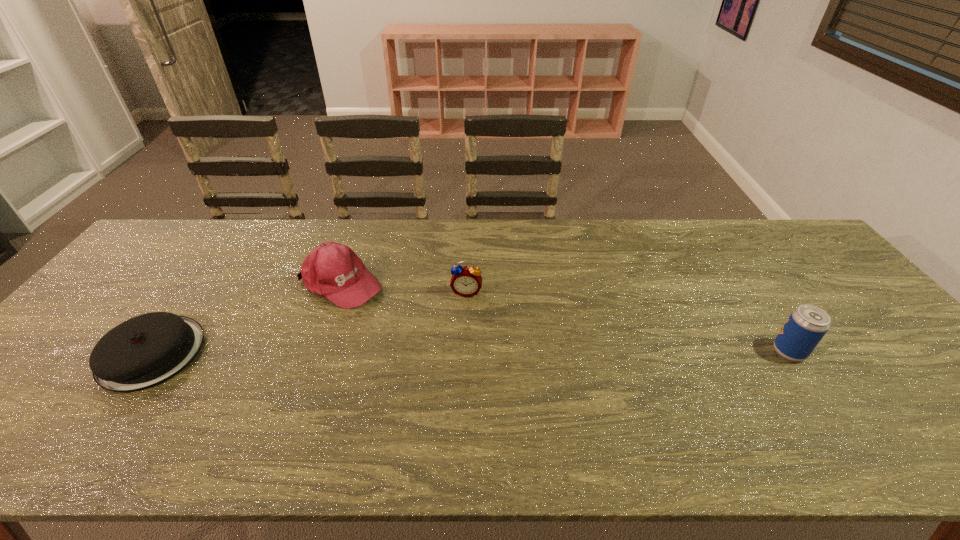
Locate an element on the screen. Image resolution: width=960 pixels, height=540 pixels. vacant space at the far left corner of the desktop is located at coordinates (211, 232).

Identify the location of free space at the near left corner of the desktop. pyautogui.click(x=24, y=399).

Locate an element on the screen. vacant space at the far right corner of the desktop is located at coordinates point(756,227).

The height and width of the screenshot is (540, 960). I want to click on vacant area that lies between the rightmost object and the baseball cap, so click(x=564, y=318).

Locate an element on the screen. The height and width of the screenshot is (540, 960). free space between the beer can and the baseball cap is located at coordinates (564, 318).

Locate an element on the screen. The height and width of the screenshot is (540, 960). vacant area that lies between the beer can and the baseball cap is located at coordinates (564, 318).

Identify the location of free spot between the alarm clock and the pancake. This screenshot has height=540, width=960. (309, 322).

The width and height of the screenshot is (960, 540). What are the coordinates of `free point between the second object from left to right and the third object from left to right` in the screenshot? It's located at (403, 288).

The height and width of the screenshot is (540, 960). What are the coordinates of `free space between the shortest object and the third object from right to left` in the screenshot? It's located at (247, 318).

Identify the location of vacant point located between the second object from left to right and the second object from right to left. tap(403, 288).